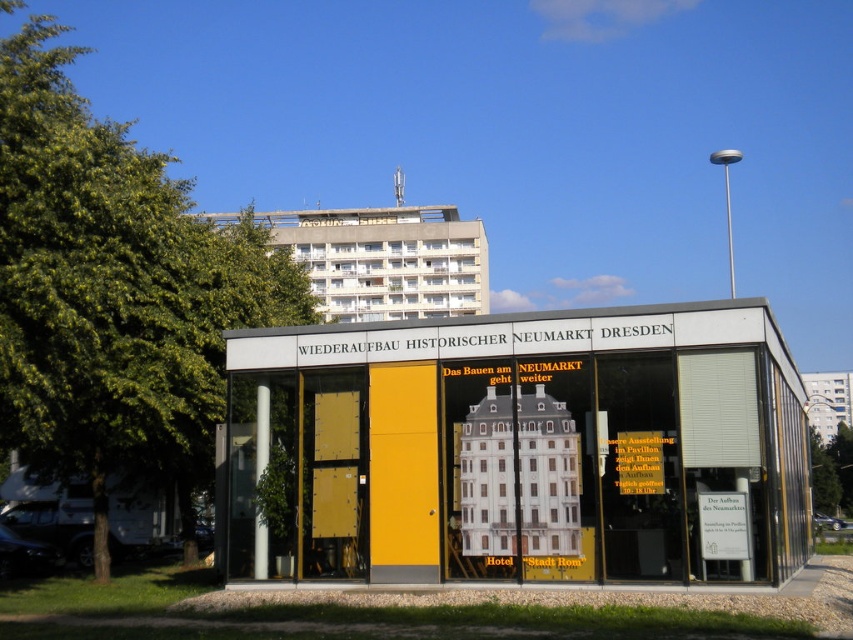
Question: Estimate the real-world distances between objects in this image. Which object is closer to the green leafy tree at left?

Choices:
 (A) green leafy tree at upper left
 (B) green leafy tree at lower right

Answer: (B)

Question: Does green leafy tree at lower right have a greater width compared to green leafy tree at upper left?

Choices:
 (A) no
 (B) yes

Answer: (B)

Question: Can you confirm if green leafy tree at left is bigger than green leafy tree at lower right?

Choices:
 (A) no
 (B) yes

Answer: (A)

Question: Is green leafy tree at lower right thinner than green leafy tree at upper left?

Choices:
 (A) yes
 (B) no

Answer: (B)

Question: Which point is closer to the camera?

Choices:
 (A) green leafy tree at upper left
 (B) green leafy tree at left

Answer: (B)

Question: Which point is farther to the camera?

Choices:
 (A) green leafy tree at lower right
 (B) green leafy tree at upper left

Answer: (B)